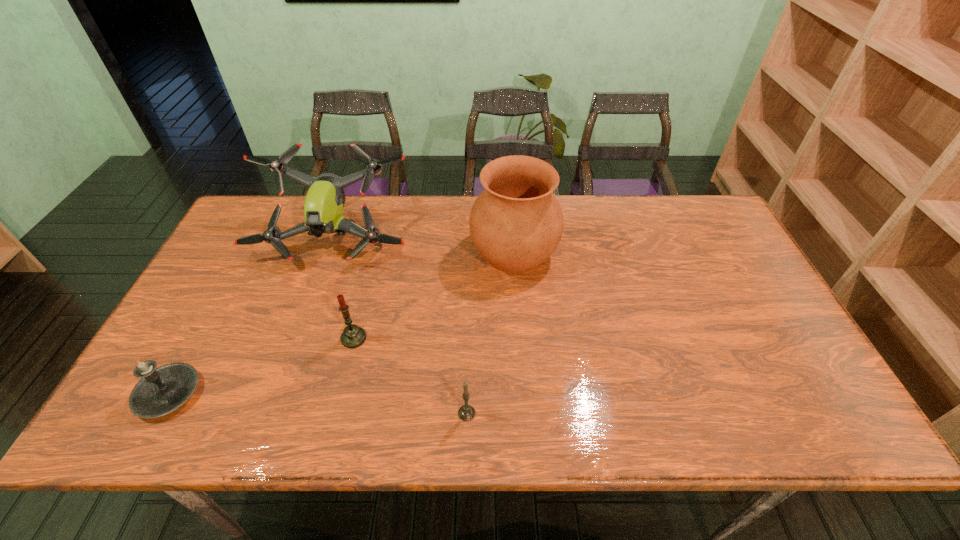
I want to click on vacant space at the far left corner, so click(240, 220).

The height and width of the screenshot is (540, 960). In order to click on vacant area at the far right corner of the desktop in this screenshot , I will do (686, 239).

The height and width of the screenshot is (540, 960). What are the coordinates of `vacant space that's between the leftmost candle and the rightmost candle` in the screenshot? It's located at (318, 403).

This screenshot has height=540, width=960. I want to click on free space between the leftmost candle and the rightmost candle, so click(318, 403).

Locate an element on the screen. The height and width of the screenshot is (540, 960). vacant space in between the farthest candle and the drone is located at coordinates (345, 289).

You are a GUI agent. You are given a task and a screenshot of the screen. Output one action in this format:
    pyautogui.click(x=<x>, y=<y>)
    Task: Click on the free space between the leftmost candle and the rightmost candle
    The image size is (960, 540).
    Given the screenshot: What is the action you would take?
    pyautogui.click(x=318, y=403)

Locate an element on the screen. unoccupied area between the drone and the rightmost candle is located at coordinates (401, 327).

This screenshot has width=960, height=540. Identify the location of empty location between the leftmost candle and the drone. (252, 316).

Locate an element on the screen. This screenshot has width=960, height=540. free space between the rightmost candle and the leftmost candle is located at coordinates (318, 403).

The width and height of the screenshot is (960, 540). I want to click on free space between the rightmost candle and the leftmost candle, so click(x=318, y=403).